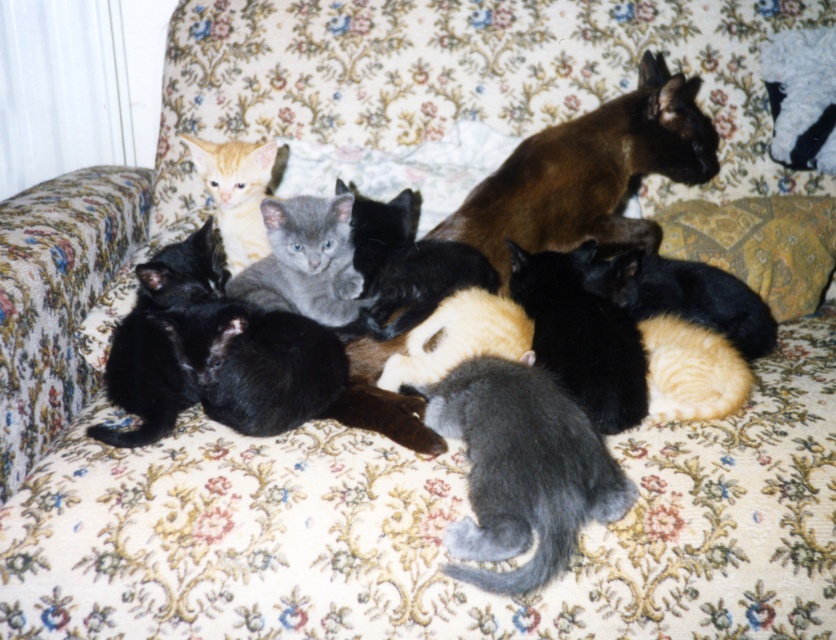
You are a photographer trying to capture a closeup of the orange fur kitten at upper left and the yellow paisley pillow at upper right. From the perspective of the camera, which object is positioned higher in the frame?

The orange fur kitten at upper left is positioned higher in the frame than the yellow paisley pillow at upper right, as the pillow is located below the kitten according to their spatial arrangement.

You are a cat photographer standing 1.5 meters away from a brown silky cat at upper right. Can you take a clear photo of it without moving closer?

The brown silky cat at upper right is 1.40 meters away from the viewer, so you are already 0.10 meters closer than your current position. To take a clear photo, you need to move back to 1.5 meters distance.

You are a cat owner who wants to place a small toy between the brown silky cat at upper right and the yellow paisley pillow at upper right. The toy requires a minimum of 5 inches of space to fit. Can you determine if there is enough space between them?

The distance between the brown silky cat at upper right and the yellow paisley pillow at upper right is 6.46 inches, which is more than the required 5 inches. Therefore, there is sufficient space to place the small toy between them.